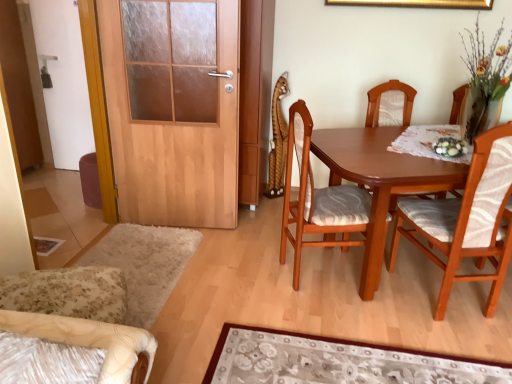
Image resolution: width=512 pixels, height=384 pixels. I want to click on free spot in front of wooden chair with patterned cushion at right, arranged as the first chair when viewed from the right, so click(x=456, y=343).